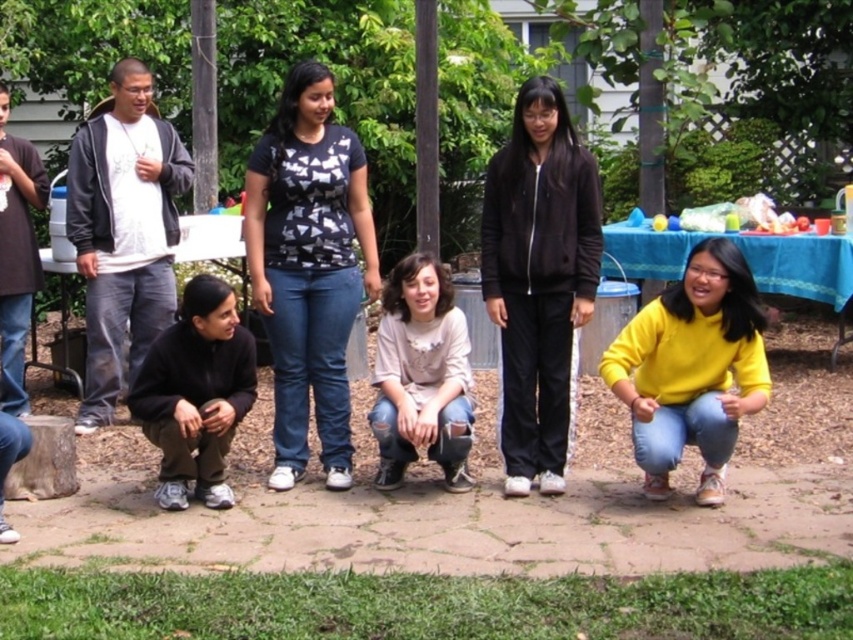
Looking at this image, is black matte jacket at center to the right of yellow matte sweater at lower right from the viewer's perspective?

In fact, black matte jacket at center is to the left of yellow matte sweater at lower right.

Which is below, black matte jacket at center or yellow matte sweater at lower right?

yellow matte sweater at lower right is below.

Identify the location of black matte jacket at center. (538, 278).

Does matte black jacket at center lie behind black matte jacket at center?

No, matte black jacket at center is in front of black matte jacket at center.

The width and height of the screenshot is (853, 640). What do you see at coordinates (310, 273) in the screenshot? I see `matte black jacket at center` at bounding box center [310, 273].

At what (x,y) coordinates should I click in order to perform the action: click on matte black jacket at center. Please return your answer as a coordinate pair (x, y). The height and width of the screenshot is (640, 853). Looking at the image, I should click on [310, 273].

Between black matte jacket at center and black fleece jacket at lower left, which one is positioned lower?

black fleece jacket at lower left

Between black matte jacket at center and black fleece jacket at lower left, which one has more height?

black matte jacket at center is taller.

This screenshot has width=853, height=640. In order to click on black matte jacket at center in this screenshot , I will do `click(538, 278)`.